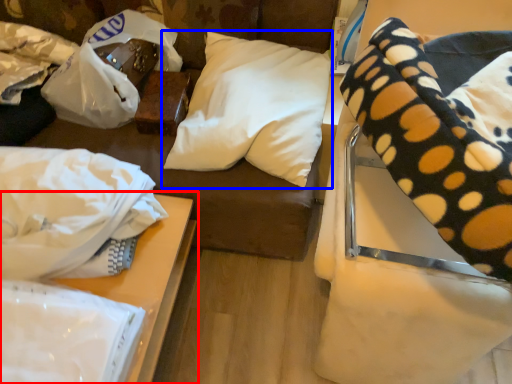
Question: Which object appears closest to the camera in this image, table (highlighted by a red box) or pillow (highlighted by a blue box)?

Choices:
 (A) table
 (B) pillow

Answer: (A)